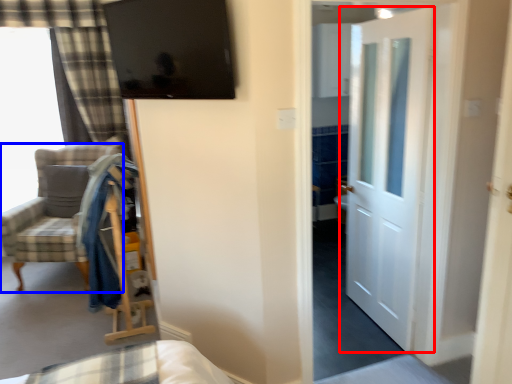
Question: Which of the following is the closest to the observer, door (highlighted by a red box) or chair (highlighted by a blue box)?

Choices:
 (A) door
 (B) chair

Answer: (A)